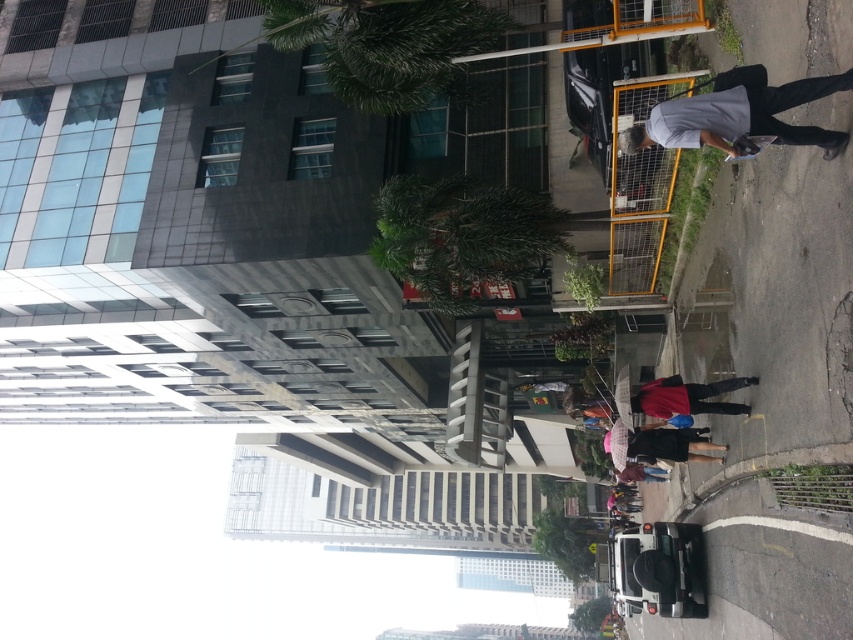
Question: Among these points, which one is farthest from the camera?

Choices:
 (A) (697, 115)
 (B) (669, 452)

Answer: (B)

Question: In this image, where is gray matte skateboard at right located relative to pink fabric umbrella at center?

Choices:
 (A) left
 (B) right

Answer: (A)

Question: Is gray matte skateboard at right thinner than pink fabric umbrella at center?

Choices:
 (A) no
 (B) yes

Answer: (A)

Question: Is gray matte skateboard at right wider than pink fabric umbrella at center?

Choices:
 (A) no
 (B) yes

Answer: (B)

Question: Which of the following is the closest to the observer?

Choices:
 (A) pink fabric umbrella at center
 (B) gray matte skateboard at right

Answer: (B)